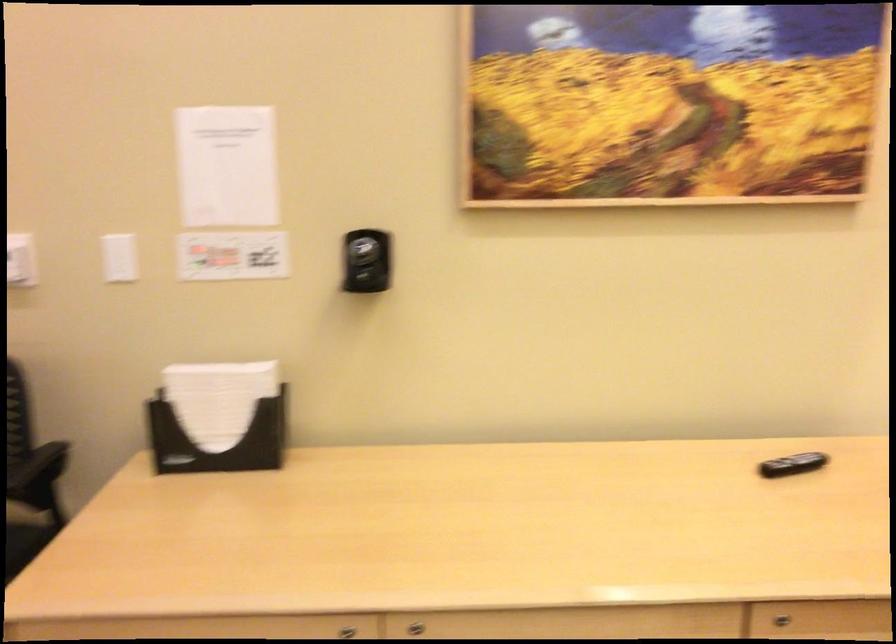
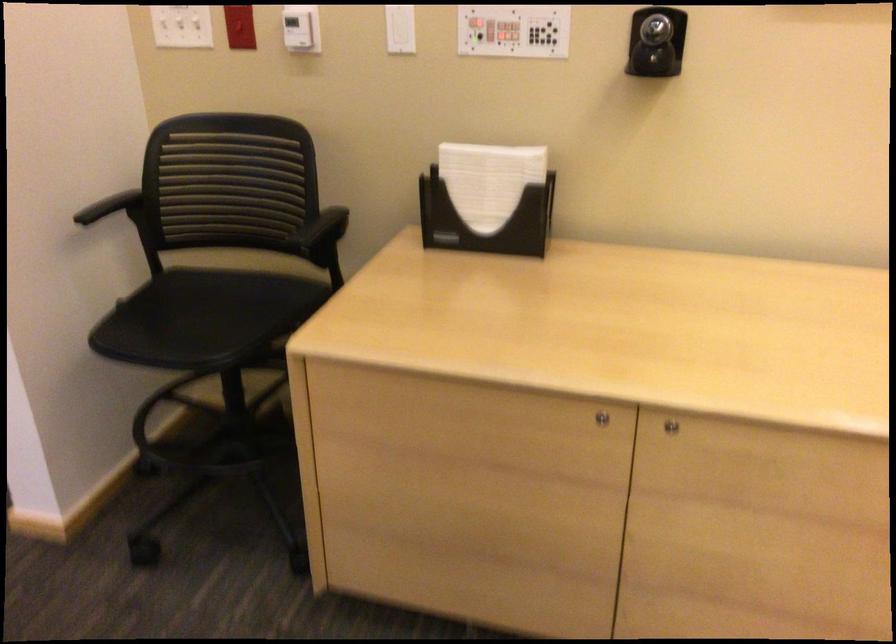
The point at [216,400] is marked in the first image. Where is the corresponding point in the second image?

(488, 180)